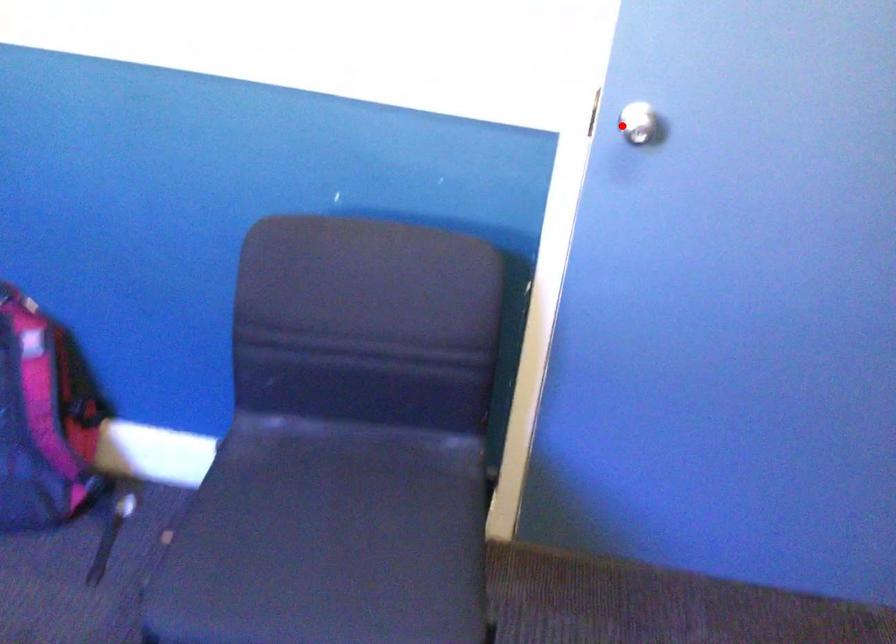
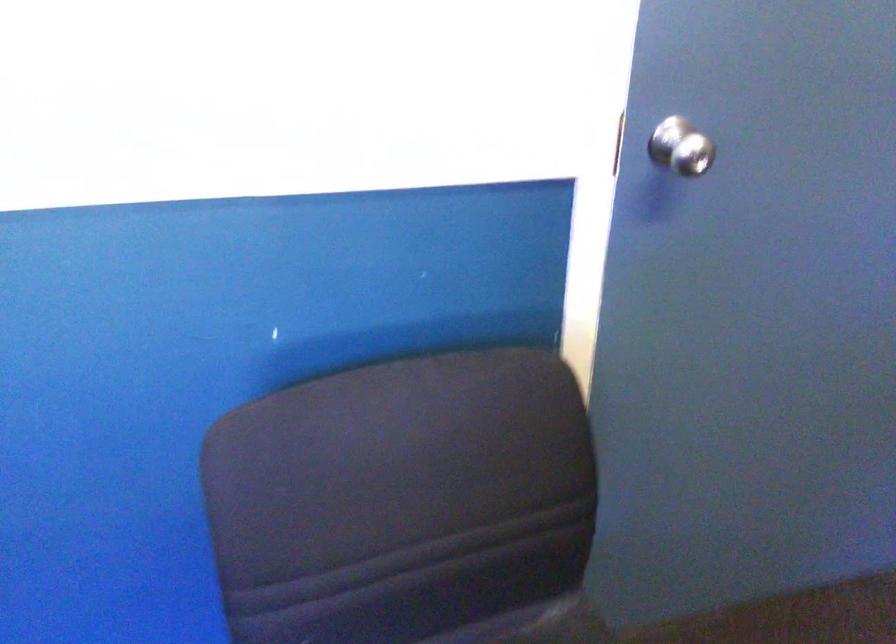
Where in the second image is the point corresponding to the highlighted location from the first image?

(681, 147)